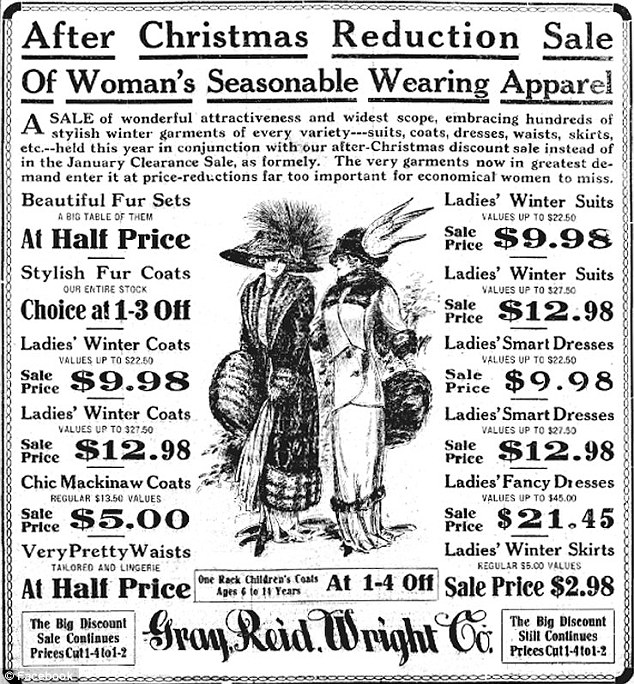
The image size is (634, 684). Identify the location of newspaper. (382, 197).